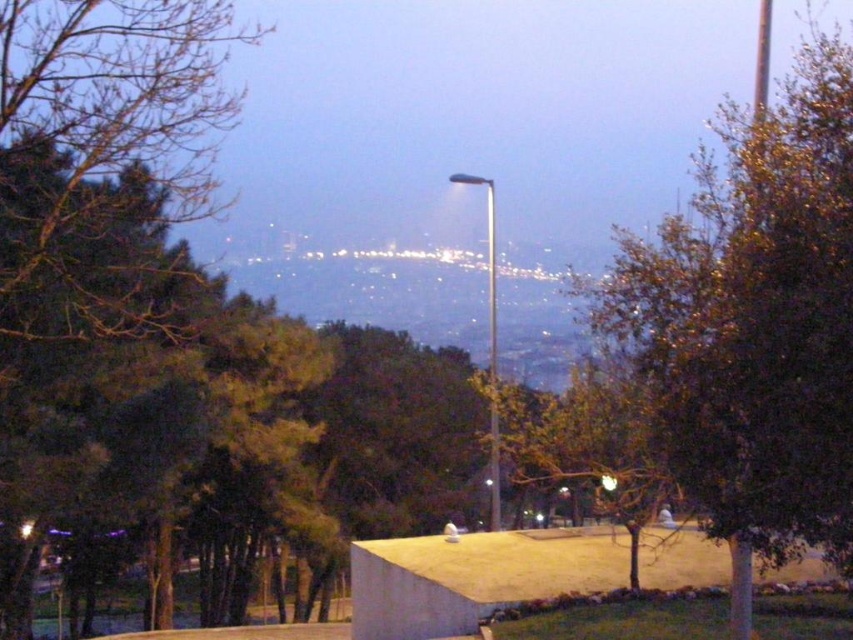
Question: Does green leafy tree at center have a larger size compared to silver metallic street light at center?

Choices:
 (A) yes
 (B) no

Answer: (A)

Question: Which point appears farthest from the camera in this image?

Choices:
 (A) (490, 332)
 (B) (824, 369)

Answer: (A)

Question: Which point appears closest to the camera in this image?

Choices:
 (A) pos(722,360)
 (B) pos(490,259)

Answer: (A)

Question: Can you confirm if green leafy tree at center is positioned below silver metallic street light at center?

Choices:
 (A) yes
 (B) no

Answer: (B)

Question: Does green leafy tree at center appear on the right side of silver metallic street light at center?

Choices:
 (A) no
 (B) yes

Answer: (B)